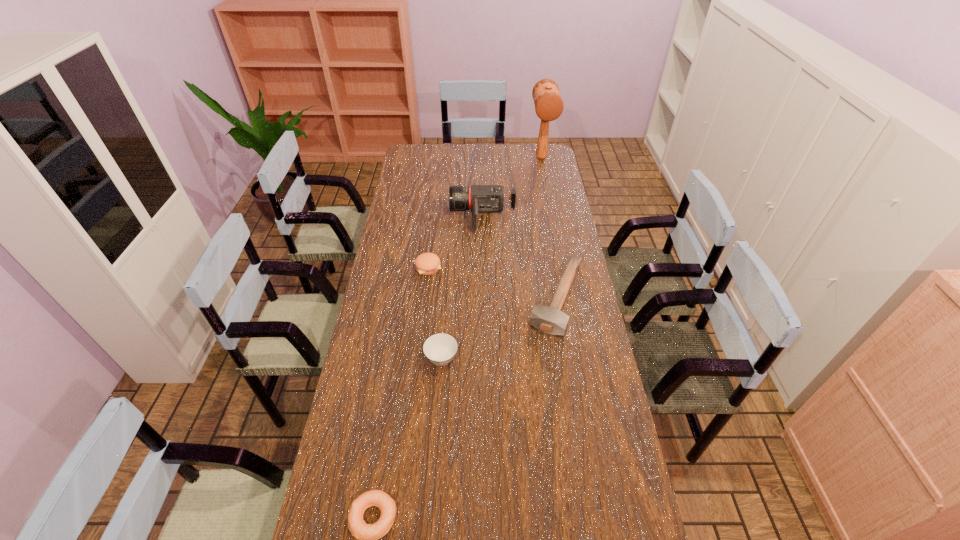
Locate an element on the screen. the tallest object is located at coordinates (549, 106).

Where is `the taller mallet`? The height and width of the screenshot is (540, 960). the taller mallet is located at coordinates (549, 106).

At what (x,y) coordinates should I click in order to perform the action: click on the fifth shortest object. Please return your answer as a coordinate pair (x, y). The height and width of the screenshot is (540, 960). Looking at the image, I should click on (479, 198).

I want to click on camcorder, so click(479, 198).

Find the location of `soup bowl`. soup bowl is located at coordinates click(x=440, y=349).

The image size is (960, 540). I want to click on the shorter mallet, so click(x=550, y=319).

This screenshot has height=540, width=960. What are the coordinates of `patty` in the screenshot? It's located at (427, 263).

What are the coordinates of `vacant region located 0.390m on the strike surface of the farthest object` in the screenshot? It's located at (552, 215).

Find the location of a particular element. Image resolution: width=960 pixels, height=540 pixels. free space located 0.140m on the lens of the fifth nearest object is located at coordinates (419, 215).

In order to click on free space located 0.150m on the lens of the fifth nearest object in this screenshot , I will do `click(417, 215)`.